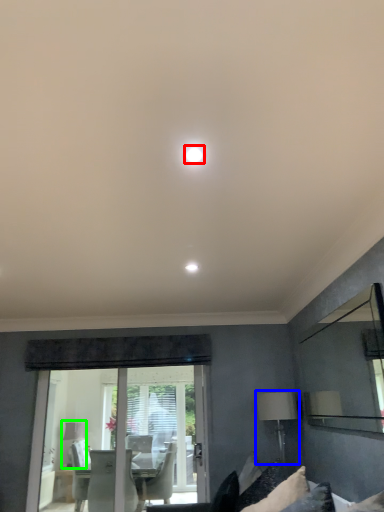
Question: Based on their relative distances, which object is nearer to lighting (highlighted by a red box)? Choose from table lamp (highlighted by a blue box) and table lamp (highlighted by a green box).

Choices:
 (A) table lamp
 (B) table lamp

Answer: (A)